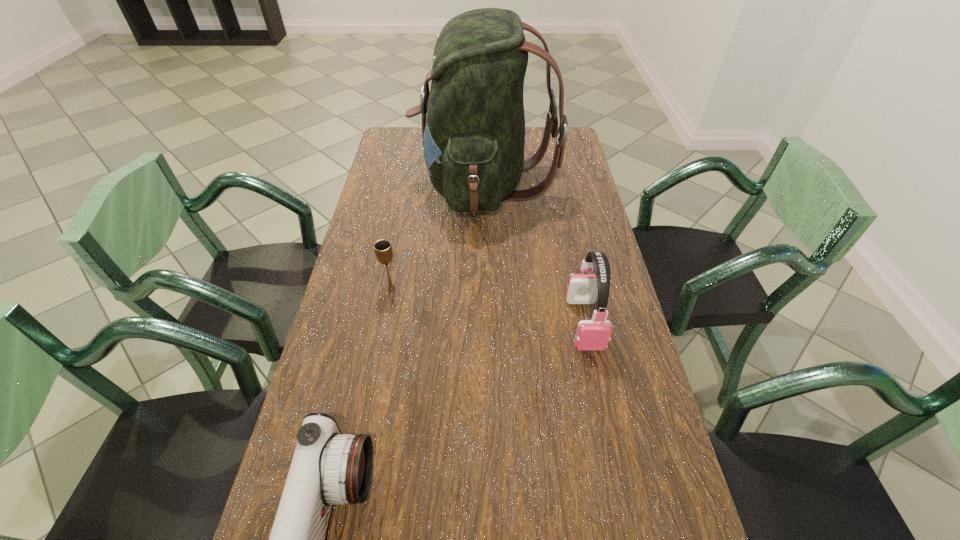
The height and width of the screenshot is (540, 960). Identify the location of object positioned at the far edge. (473, 124).

Where is `backpack situated at the left edge`? This screenshot has width=960, height=540. backpack situated at the left edge is located at coordinates (473, 124).

The height and width of the screenshot is (540, 960). Identify the location of chalice that is at the left edge. (383, 250).

Find the location of a particular element. The image size is (960, 540). backpack located at the right edge is located at coordinates tap(473, 124).

The height and width of the screenshot is (540, 960). I want to click on earphone at the right edge, so click(x=592, y=335).

I want to click on object positioned at the far left corner, so click(473, 124).

At what (x,y) coordinates should I click in order to perform the action: click on object that is at the far right corner. Please return your answer as a coordinate pair (x, y). The height and width of the screenshot is (540, 960). Looking at the image, I should click on (473, 124).

Locate an element on the screen. The width and height of the screenshot is (960, 540). free region at the left edge of the desktop is located at coordinates (380, 160).

The image size is (960, 540). Identify the location of vacant area at the right edge. (616, 336).

You are a GUI agent. You are given a task and a screenshot of the screen. Output one action in this format:
    pyautogui.click(x=<x>, y=<y>)
    Task: Click on the vacant space at the far left corner of the desktop
    This screenshot has width=960, height=540.
    Given the screenshot: What is the action you would take?
    pyautogui.click(x=398, y=154)